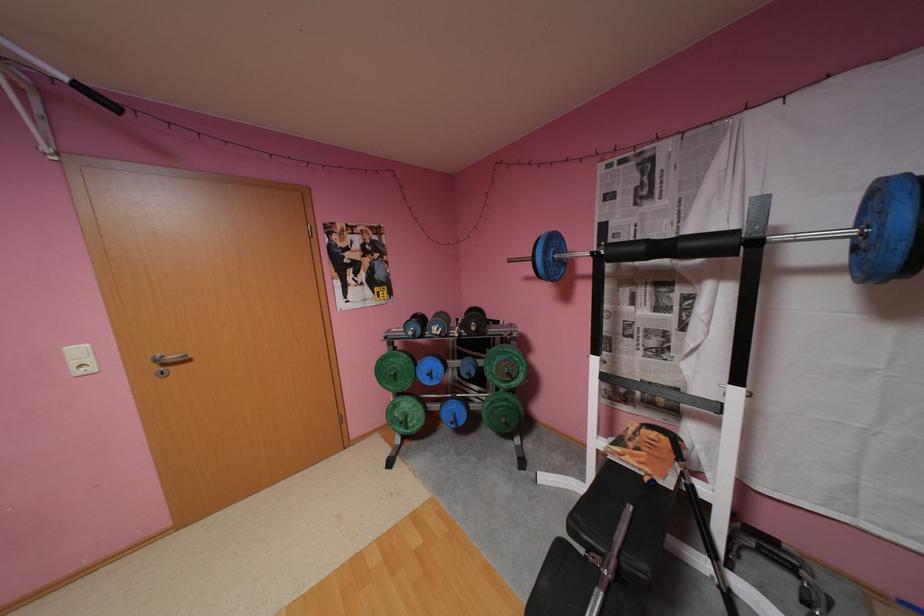
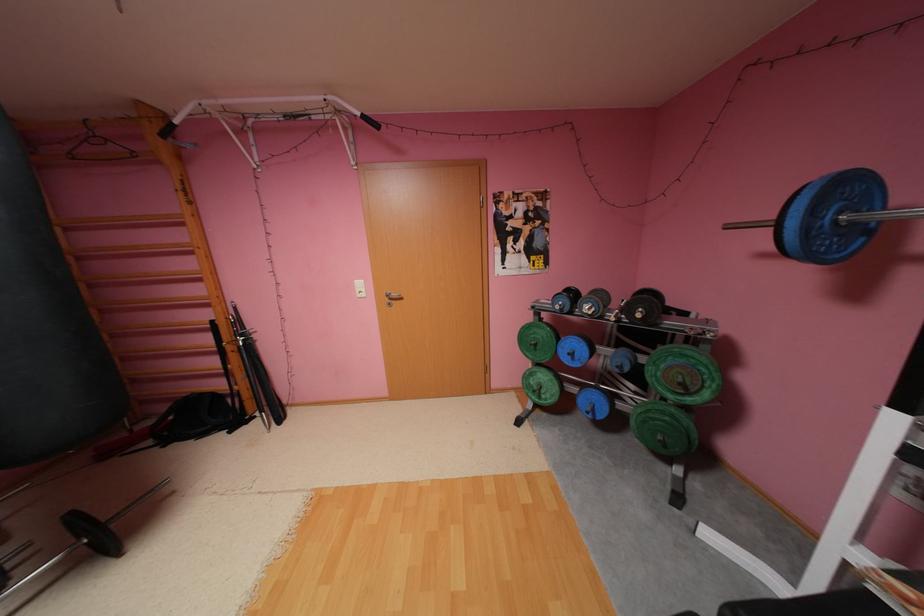
In the second image, find the point that corresponds to point 423,334 in the first image.

(570, 310)